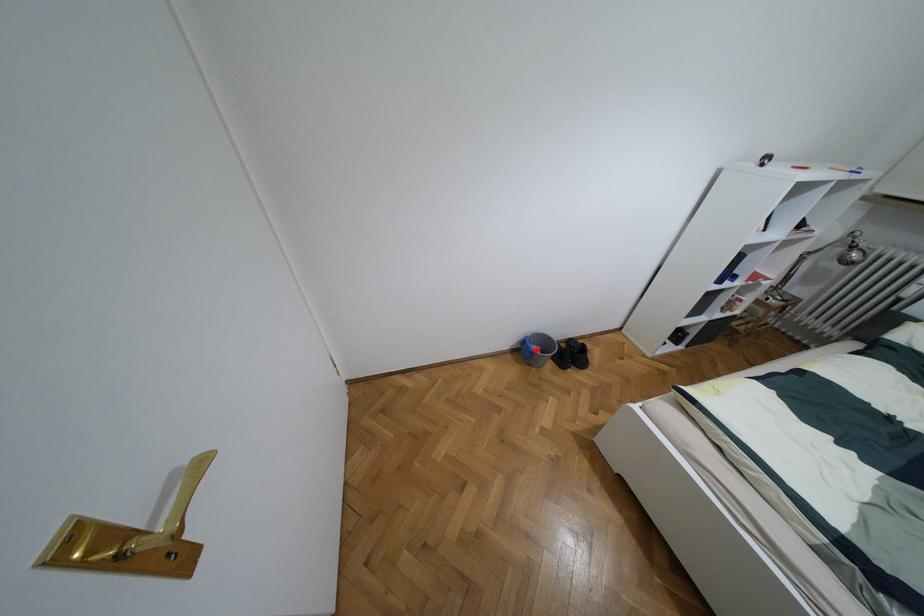
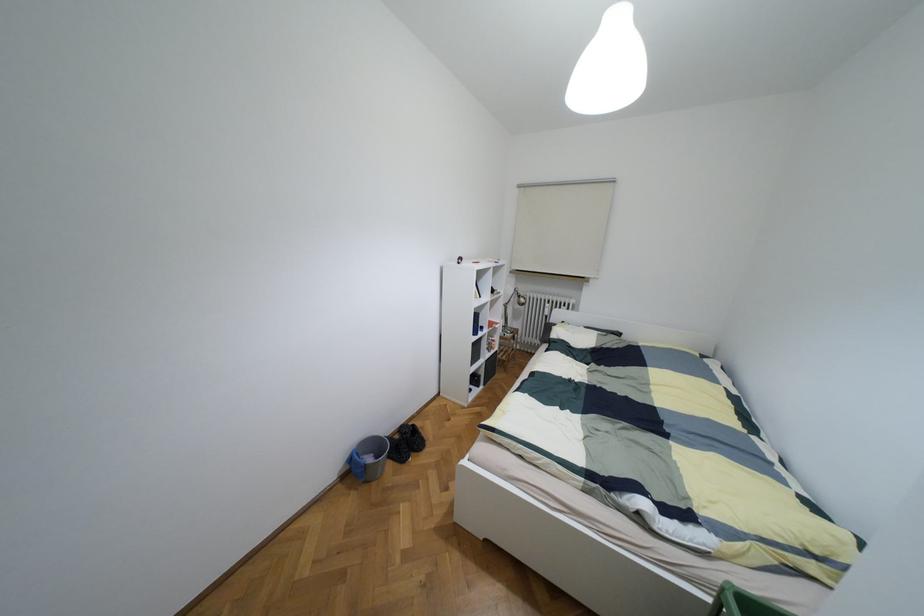
Question: I am providing you with two images of the same scene from different viewpoints. Given a red point in image1, look at the same physical point in image2. Is it:

Choices:
 (A) Closer to the viewpoint
 (B) Farther from the viewpoint

Answer: (A)